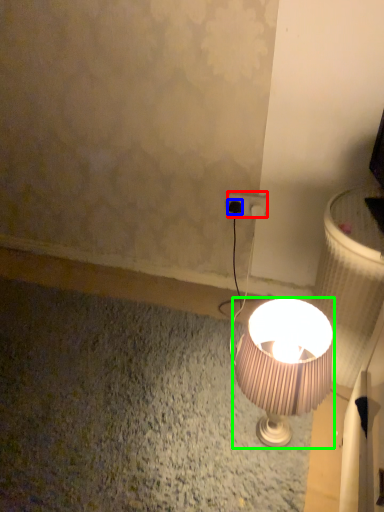
Question: Considering the real-world distances, which object is closest to power plugs and sockets (highlighted by a red box)? plug (highlighted by a blue box) or lamp (highlighted by a green box).

Choices:
 (A) plug
 (B) lamp

Answer: (A)